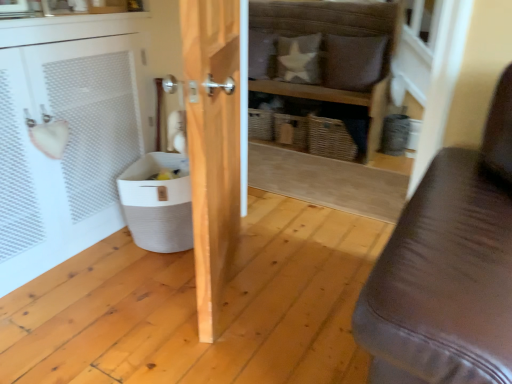
Question: Is point (195, 198) closer or farther from the camera than point (348, 87)?

Choices:
 (A) closer
 (B) farther

Answer: (A)

Question: Is wooden door at center taller or shorter than wooden shelf at center?

Choices:
 (A) short
 (B) tall

Answer: (B)

Question: Which is farther from the wooden door at center?

Choices:
 (A) white fabric pillow at upper center, the second pillow when ordered from right to left
 (B) brown leather pillow at upper center, acting as the second pillow starting from the left
 (C) wooden shelf at center
 (D) white woven laundry basket at lower left
 (E) white mesh cabinet at left

Answer: (A)

Question: Considering the real-world distances, which object is closest to the wooden door at center?

Choices:
 (A) white woven laundry basket at lower left
 (B) wooden shelf at center
 (C) brown leather pillow at upper center, acting as the second pillow starting from the left
 (D) white fabric pillow at upper center, the second pillow when ordered from right to left
 (E) white mesh cabinet at left

Answer: (A)